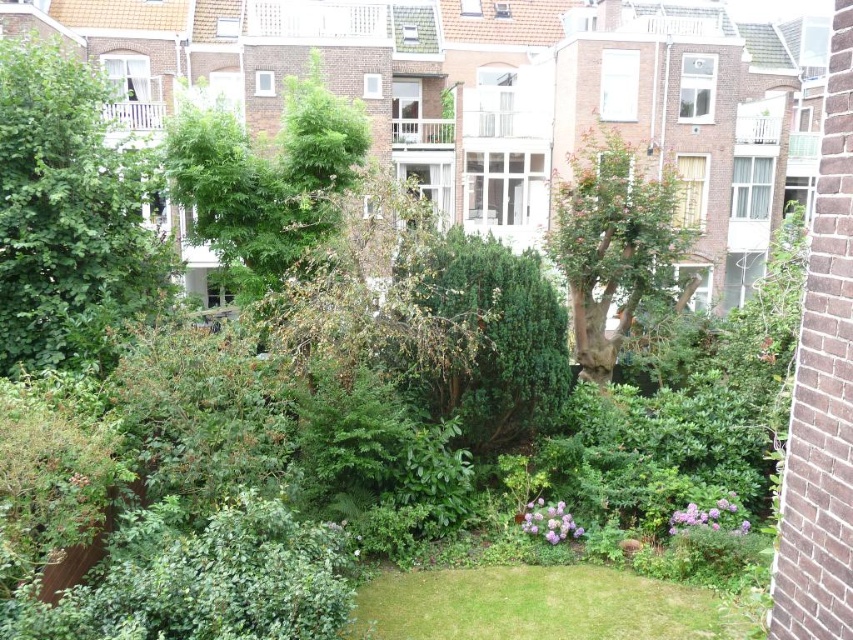
Question: Which point is farther from the camera taking this photo?

Choices:
 (A) (476, 436)
 (B) (460, 573)

Answer: (A)

Question: Is green grass at lower center below green leafy tree at center?

Choices:
 (A) yes
 (B) no

Answer: (A)

Question: Considering the relative positions of green leafy tree at left and green leafy tree at center in the image provided, where is green leafy tree at left located with respect to green leafy tree at center?

Choices:
 (A) above
 (B) below

Answer: (B)

Question: Among these points, which one is nearest to the camera?

Choices:
 (A) (552, 636)
 (B) (498, 308)

Answer: (A)

Question: Considering the relative positions of green leafy tree at left and green grass at lower center in the image provided, where is green leafy tree at left located with respect to green grass at lower center?

Choices:
 (A) right
 (B) left

Answer: (B)

Question: Which is farther from the green leafy tree at left?

Choices:
 (A) green grass at lower center
 (B) green leafy tree at center

Answer: (B)